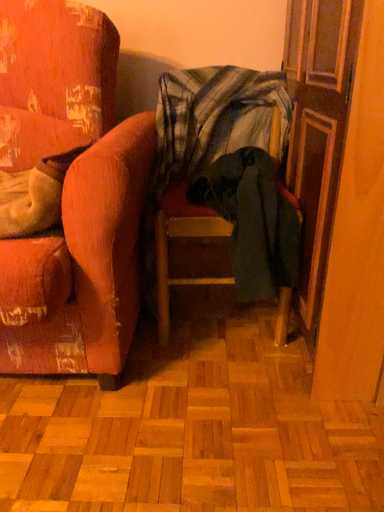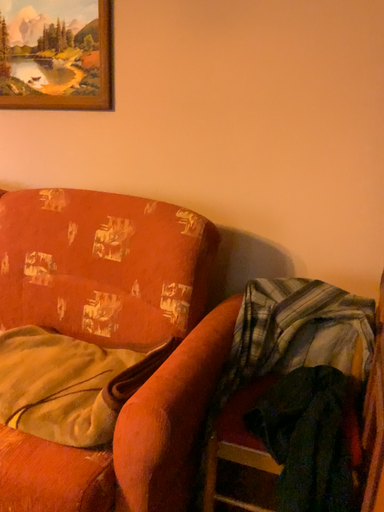
Question: How did the camera likely rotate when shooting the video?

Choices:
 (A) rotated right
 (B) rotated left

Answer: (B)